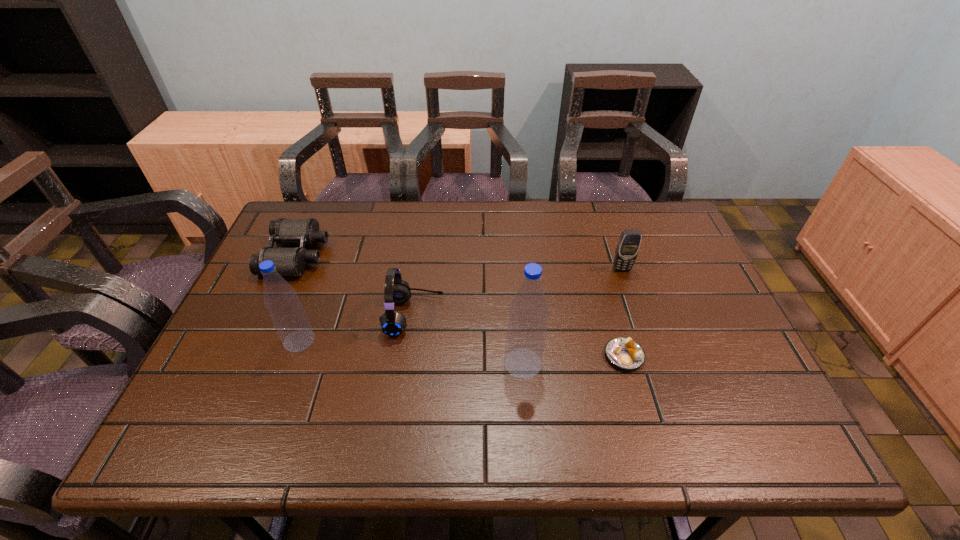
Image resolution: width=960 pixels, height=540 pixels. Identify the location of vacant space in between the pastry and the cellular telephone. (623, 312).

This screenshot has height=540, width=960. Find the location of `free area in between the second shortest object and the headset`. free area in between the second shortest object and the headset is located at coordinates (355, 286).

Where is `vacant area between the shortest object and the cellular telephone`? The width and height of the screenshot is (960, 540). vacant area between the shortest object and the cellular telephone is located at coordinates (623, 312).

Locate which object ranks third in proximity to the fifth tallest object. Please provide its 2D coordinates. Your answer should be formatted as a tuple, i.e. [(x, y)], where the tuple contains the x and y coordinates of a point satisfying the conditions above.

[(528, 313)]

Where is `the closest object to the cellular telephone`? the closest object to the cellular telephone is located at coordinates (625, 353).

You are a GUI agent. You are given a task and a screenshot of the screen. Output one action in this format:
    pyautogui.click(x=<x>, y=<y>)
    Task: Click on the vacant position in the image that satisfies the following two spatial constraints: 1. on the back side of the left water bottle; 2. through the eyepieces of the second shortest object
    Image resolution: width=960 pixels, height=540 pixels.
    Given the screenshot: What is the action you would take?
    pyautogui.click(x=331, y=255)

Identify the location of free space that satisfies the following two spatial constraints: 1. through the eyepieces of the fifth tallest object; 2. on the left side of the shortest object. (251, 356).

Locate an element on the screen. Image resolution: width=960 pixels, height=540 pixels. free location that satisfies the following two spatial constraints: 1. through the eyepieces of the taller water bottle; 2. on the right side of the fifth tallest object is located at coordinates (248, 363).

Locate an element on the screen. Image resolution: width=960 pixels, height=540 pixels. free space that satisfies the following two spatial constraints: 1. on the ear cushions of the tallest object; 2. on the left side of the headset is located at coordinates (407, 363).

In order to click on free region that satisfies the following two spatial constraints: 1. on the back side of the tallest object; 2. through the eyepieces of the binoculars in this screenshot , I will do `click(514, 255)`.